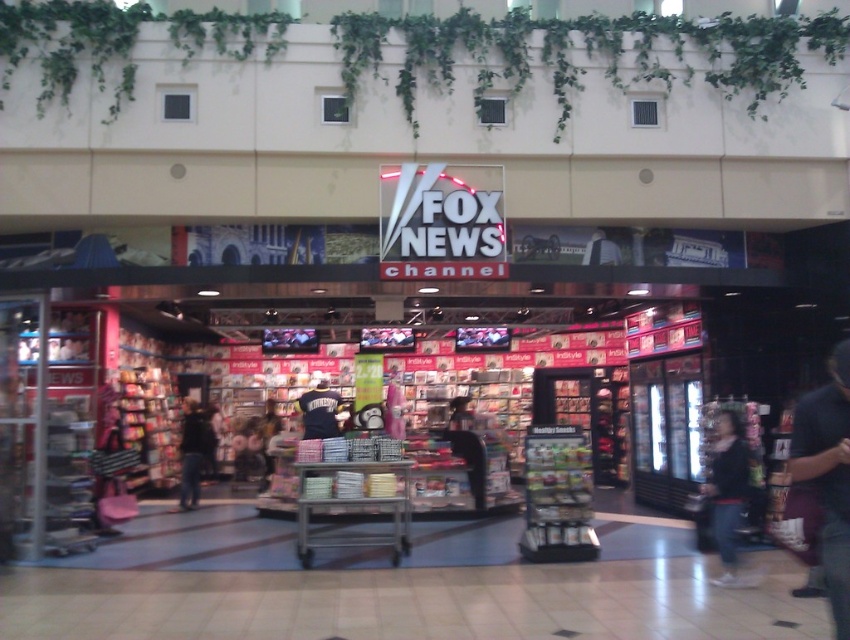
You are a customer standing at the entrance of the Fox News Channel kiosk. You notice a dark blue shirt at lower right and a dark blue jeans at lower right. Can you reach both items at the same time if you extend your arms fully? Assume your arm span is 1.8 meters.

The dark blue shirt at lower right and dark blue jeans at lower right are 4.04 meters apart. Since your arm span is only 1.8 meters, you cannot reach both items simultaneously.

You are a customer at the Fox News Channel kiosk. You want to buy a wider item. Which one should you choose between the dark clothing at center and the black jersey at center?

The black jersey at center is wider than the dark clothing at center, so you should choose the black jersey at center.